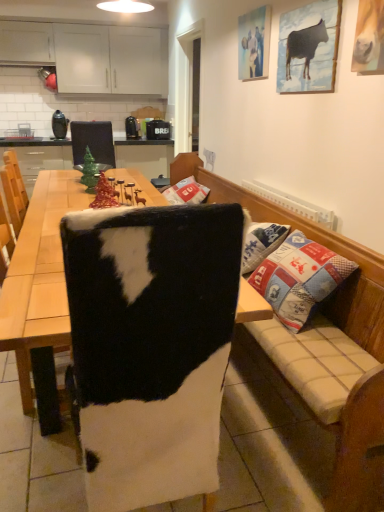
Question: Considering the relative positions of white matte cabinets at upper left and green glossy christmas tree at upper left in the image provided, is white matte cabinets at upper left to the left or to the right of green glossy christmas tree at upper left?

Choices:
 (A) right
 (B) left

Answer: (B)

Question: In terms of height, does white matte cabinets at upper left look taller or shorter compared to green glossy christmas tree at upper left?

Choices:
 (A) tall
 (B) short

Answer: (A)

Question: Which is farther from the white matte cabinets at upper left?

Choices:
 (A) cowhide cushion at center
 (B) wooden picture frame at upper right, which is counted as the 2th picture frame, starting from the left
 (C) cowhide at center
 (D) wooden picture frame at upper center, which appears as the 1th picture frame when viewed from the left
 (E) green glossy christmas tree at upper left

Answer: (C)

Question: Based on their relative distances, which object is farther from the cowhide cushion at center?

Choices:
 (A) green glossy christmas tree at upper left
 (B) wooden picture frame at upper right, which is counted as the 2th picture frame, starting from the left
 (C) white matte cabinets at upper left
 (D) wooden picture frame at upper center, the second picture frame in the right-to-left sequence
 (E) cowhide at center

Answer: (C)